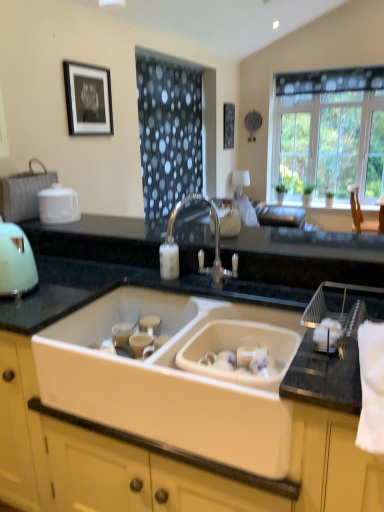
Question: Can you confirm if matte green kettle at left is wider than satin nickel faucet at center?

Choices:
 (A) no
 (B) yes

Answer: (A)

Question: Does matte green kettle at left come behind satin nickel faucet at center?

Choices:
 (A) yes
 (B) no

Answer: (A)

Question: Could you tell me if matte green kettle at left is turned towards satin nickel faucet at center?

Choices:
 (A) no
 (B) yes

Answer: (B)

Question: Considering the relative sizes of matte green kettle at left and satin nickel faucet at center in the image provided, is matte green kettle at left smaller than satin nickel faucet at center?

Choices:
 (A) no
 (B) yes

Answer: (B)

Question: Can you confirm if matte green kettle at left is taller than satin nickel faucet at center?

Choices:
 (A) yes
 (B) no

Answer: (B)

Question: Does matte green kettle at left have a larger size compared to satin nickel faucet at center?

Choices:
 (A) no
 (B) yes

Answer: (A)

Question: From the image's perspective, is black matte picture frame at upper center, arranged as the first picture frame when viewed from the back, on top of satin nickel faucet at center?

Choices:
 (A) no
 (B) yes

Answer: (B)

Question: Are black matte picture frame at upper center, marked as the 1th picture frame in a right-to-left arrangement, and satin nickel faucet at center far apart?

Choices:
 (A) no
 (B) yes

Answer: (B)

Question: Can you confirm if black matte picture frame at upper center, marked as the 1th picture frame in a right-to-left arrangement, is smaller than satin nickel faucet at center?

Choices:
 (A) yes
 (B) no

Answer: (A)

Question: Is black matte picture frame at upper center, arranged as the first picture frame when viewed from the back, in contact with satin nickel faucet at center?

Choices:
 (A) yes
 (B) no

Answer: (B)

Question: Is black matte picture frame at upper center, arranged as the 2th picture frame when viewed from the front, outside of satin nickel faucet at center?

Choices:
 (A) no
 (B) yes

Answer: (B)

Question: Is black matte picture frame at upper center, placed as the 2th picture frame when sorted from left to right, positioned in front of satin nickel faucet at center?

Choices:
 (A) yes
 (B) no

Answer: (B)

Question: Is satin nickel faucet at center to the right of matte green kettle at left from the viewer's perspective?

Choices:
 (A) yes
 (B) no

Answer: (A)